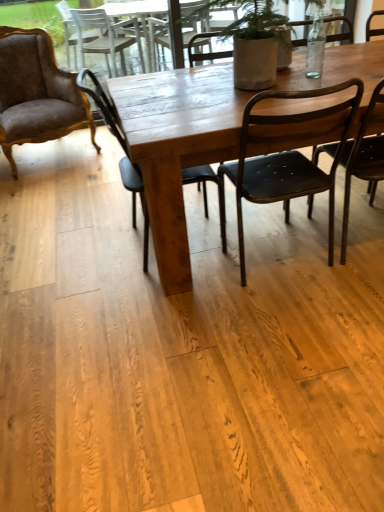
Where is `unoccupied area in front of black metal chair at center, which is the second chair in right-to-left order`? The image size is (384, 512). unoccupied area in front of black metal chair at center, which is the second chair in right-to-left order is located at coordinates (288, 323).